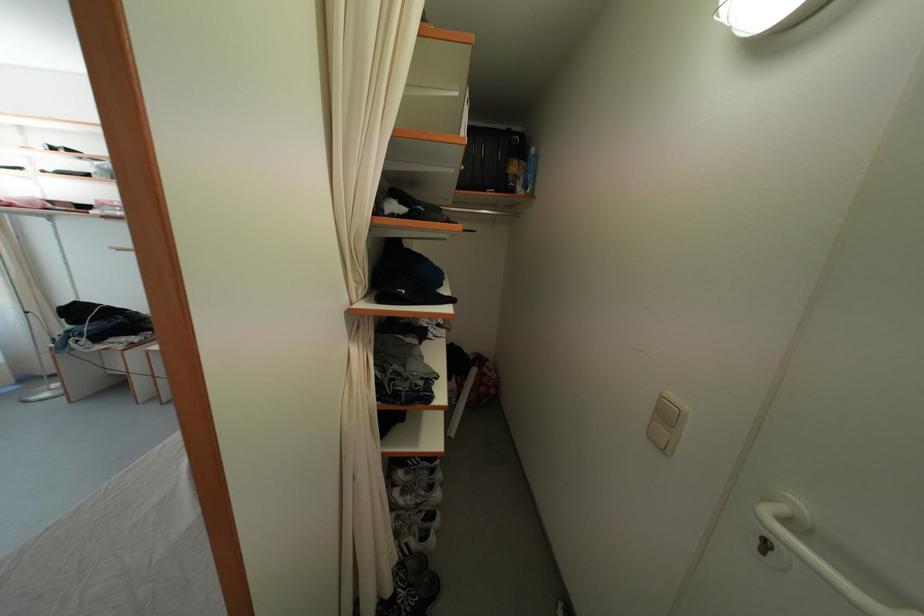
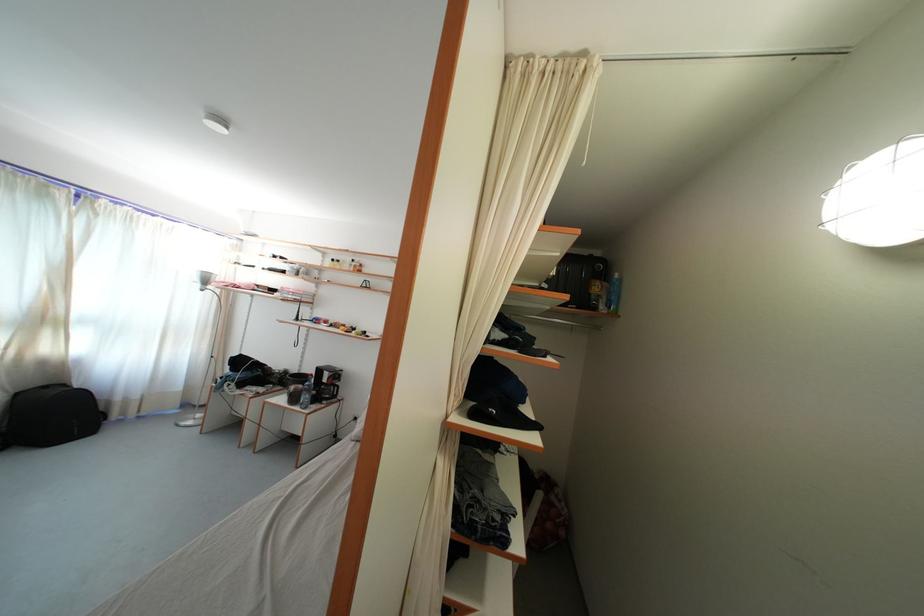
Where in the second image is the point corresponding to (532,195) from the first image?

(615, 314)